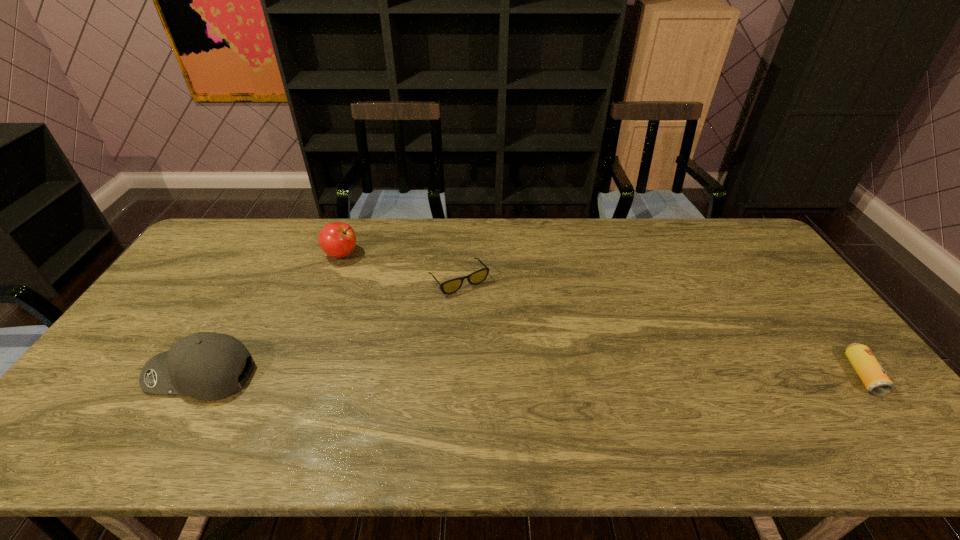
Identify the location of vacant area at the near edge. (244, 400).

Identify the location of free space at the right edge of the desktop. The image size is (960, 540). (759, 274).

You are a GUI agent. You are given a task and a screenshot of the screen. Output one action in this format:
    pyautogui.click(x=<x>, y=<y>)
    Task: Click on the vacant point at the far left corner
    The height and width of the screenshot is (540, 960).
    Given the screenshot: What is the action you would take?
    pyautogui.click(x=253, y=223)

This screenshot has height=540, width=960. What are the coordinates of `unoccupied area between the beer can and the second object from right to left` in the screenshot? It's located at (660, 327).

Identify the location of vacant area that lies between the rightmost object and the sunglasses. (660, 327).

This screenshot has height=540, width=960. I want to click on free spot between the third object from left to right and the second object from left to right, so [400, 267].

Identify the location of vacant area between the third object from right to left and the beer can. (602, 314).

The height and width of the screenshot is (540, 960). I want to click on free space between the second object from right to left and the leftmost object, so click(330, 327).

The image size is (960, 540). I want to click on vacant area between the second object from right to left and the beer can, so click(x=660, y=327).

Locate an element on the screen. vacant space that is in between the second object from left to right and the rightmost object is located at coordinates (602, 314).